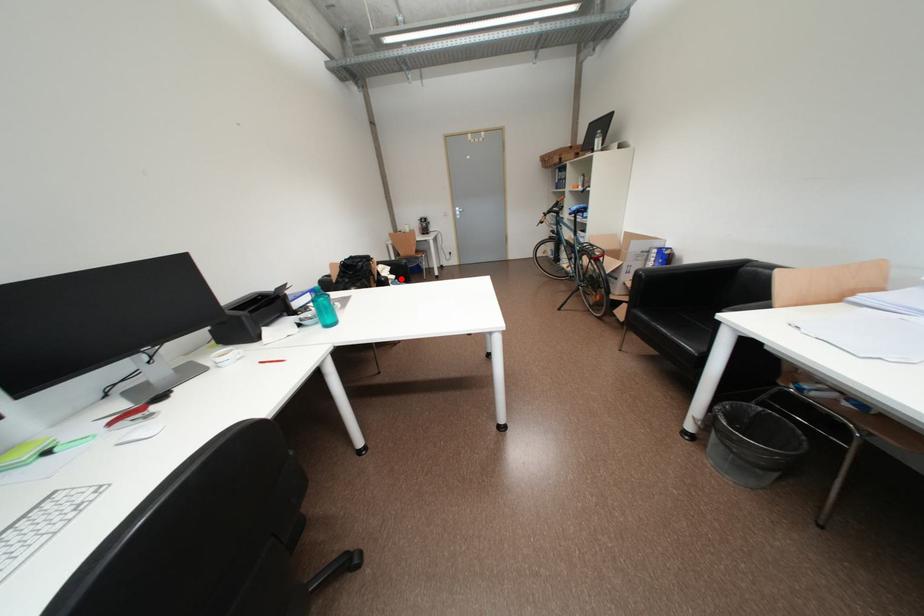
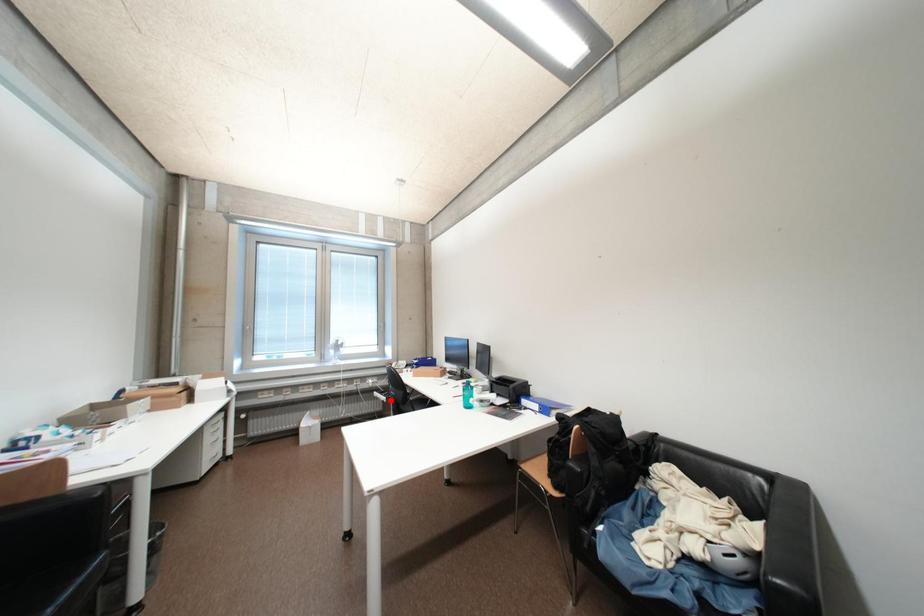
I am providing you with two images of the same scene from different viewpoints. A red point is marked on the first image and another point is marked on the second image. Do the highlighted points in image1 and image2 indicate the same real-world spot?

No